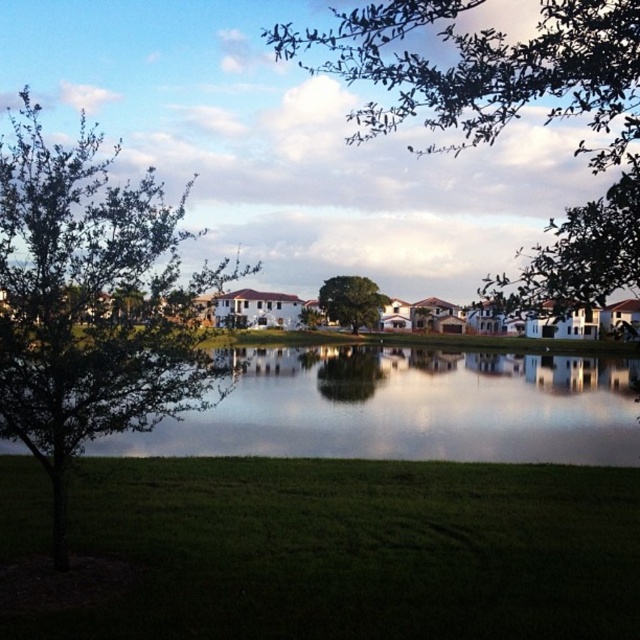
Does green leafy tree at upper center have a smaller size compared to green leafy tree at center?

No.

Image resolution: width=640 pixels, height=640 pixels. Find the location of `green leafy tree at upper center`. green leafy tree at upper center is located at coordinates (512, 109).

Who is more distant from viewer, (x=48, y=472) or (x=588, y=204)?

The point (x=588, y=204) is more distant.

What do you see at coordinates (92, 304) in the screenshot? I see `green leafy tree at left` at bounding box center [92, 304].

The image size is (640, 640). Find the location of `green leafy tree at left`. green leafy tree at left is located at coordinates (92, 304).

Is clear glass water at center below green leafy tree at upper center?

Yes, clear glass water at center is below green leafy tree at upper center.

Is point (614, 461) in front of point (349, 26)?

Yes.

Identify the location of clear glass water at center. The height and width of the screenshot is (640, 640). (408, 406).